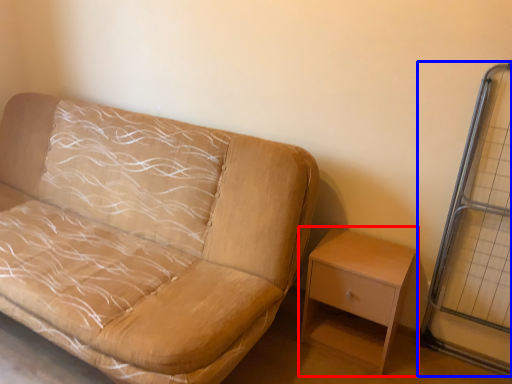
Question: Which point is closer to the camera, nightstand (highlighted by a red box) or glass door (highlighted by a blue box)?

Choices:
 (A) nightstand
 (B) glass door

Answer: (B)